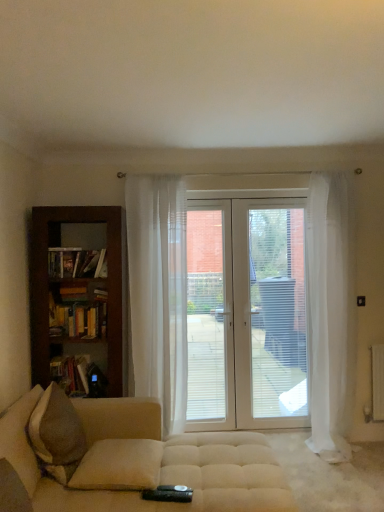
Question: Is beige fabric studio couch at lower left taller or shorter than sheer white curtain at center, the 2th curtain in the right-to-left sequence?

Choices:
 (A) tall
 (B) short

Answer: (B)

Question: Considering the positions of point (114, 407) and point (182, 216), is point (114, 407) closer or farther from the camera than point (182, 216)?

Choices:
 (A) closer
 (B) farther

Answer: (A)

Question: Considering the real-world distances, which object is farthest from the white sheer curtain at right, positioned as the 1th curtain in right-to-left order?

Choices:
 (A) dark wood bookcase at left
 (B) beige fabric pillow at lower center, arranged as the 1th pillow when viewed from the back
 (C) wooden bookshelf at left, the 1th book viewed from the top
 (D) beige fabric pillow at lower left, which is the 1th pillow in front-to-back order
 (E) hardcover book at left, the second book positioned from the top

Answer: (D)

Question: Considering the real-world distances, which object is farthest from the beige fabric pillow at lower center, arranged as the 1th pillow when viewed from the back?

Choices:
 (A) white sheer curtain at right, positioned as the 1th curtain in right-to-left order
 (B) beige fabric studio couch at lower left
 (C) white glossy door at center
 (D) wooden bookshelf at left, the 1th book viewed from the top
 (E) hardcover book at left, which is counted as the first book, starting from the bottom

Answer: (A)